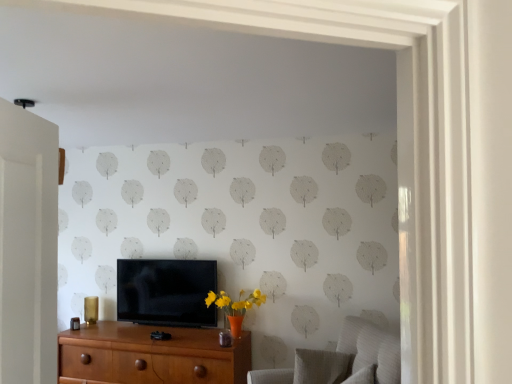
The height and width of the screenshot is (384, 512). I want to click on brown wood chest of drawers at lower center, so click(150, 355).

This screenshot has height=384, width=512. What do you see at coordinates (342, 358) in the screenshot?
I see `textured gray swivel chair at lower right, marked as the second swivel chair in a back-to-front arrangement` at bounding box center [342, 358].

Find the location of a particular element. This screenshot has width=512, height=384. brown wood chest of drawers at lower center is located at coordinates (150, 355).

From a real-world perspective, which object stands above the other?

From a 3D spatial view, textured gray swivel chair at lower right, the first swivel chair viewed from the front, is above.

Is brown wood chest of drawers at lower center next to textured gray swivel chair at lower right, the first swivel chair viewed from the front, and touching it?

They are not placed beside each other.

Between brown wood chest of drawers at lower center and textured gray swivel chair at lower right, marked as the second swivel chair in a back-to-front arrangement, which one has larger width?

textured gray swivel chair at lower right, marked as the second swivel chair in a back-to-front arrangement.

From the image's perspective, is brown wood chest of drawers at lower center over textured gray swivel chair at lower right, marked as the second swivel chair in a back-to-front arrangement?

No, from the image's perspective, brown wood chest of drawers at lower center is not above textured gray swivel chair at lower right, marked as the second swivel chair in a back-to-front arrangement.

Between brown wood chest of drawers at lower center and matte black tv at center, which one has larger size?

brown wood chest of drawers at lower center is bigger.

Does brown wood chest of drawers at lower center come behind matte black tv at center?

No, it is in front of matte black tv at center.

Can you tell me how much brown wood chest of drawers at lower center and matte black tv at center differ in facing direction?

They differ by 2.08 degrees in their facing directions.

In the image, there is a matte black tv at center. Where is `the chest of drawers below it (from the image's perspective)`? the chest of drawers below it (from the image's perspective) is located at coordinates (150, 355).

Is point (356, 356) in front of point (284, 372)?

Yes, it is in front of point (284, 372).

The image size is (512, 384). In the image, there is a textured gray swivel chair at lower right, the 1th swivel chair when ordered from back to front. Find the location of `swivel chair above it (from the image's perspective)`. swivel chair above it (from the image's perspective) is located at coordinates (342, 358).

From a real-world perspective, is textured gray swivel chair at lower right, marked as the second swivel chair in a back-to-front arrangement, over textured gray swivel chair at lower right, the 1th swivel chair when ordered from back to front?

Yes, from a real-world perspective, textured gray swivel chair at lower right, marked as the second swivel chair in a back-to-front arrangement, is above textured gray swivel chair at lower right, the 1th swivel chair when ordered from back to front.

How many degrees apart are the facing directions of textured gray swivel chair at lower right, marked as the second swivel chair in a back-to-front arrangement, and textured gray swivel chair at lower right, the 1th swivel chair when ordered from back to front?

textured gray swivel chair at lower right, marked as the second swivel chair in a back-to-front arrangement, and textured gray swivel chair at lower right, the 1th swivel chair when ordered from back to front, are facing 73.9 degrees away from each other.

Where is `television above the textured gray swivel chair at lower right, the first swivel chair viewed from the front (from the image's perspective)`? This screenshot has height=384, width=512. television above the textured gray swivel chair at lower right, the first swivel chair viewed from the front (from the image's perspective) is located at coordinates (166, 292).

Is matte black tv at center bigger than textured gray swivel chair at lower right, the first swivel chair viewed from the front?

No, matte black tv at center is not bigger than textured gray swivel chair at lower right, the first swivel chair viewed from the front.

Is matte black tv at center positioned far away from textured gray swivel chair at lower right, the first swivel chair viewed from the front?

Yes, matte black tv at center is far from textured gray swivel chair at lower right, the first swivel chair viewed from the front.

Measure the distance from matte black tv at center to textured gray swivel chair at lower right, marked as the second swivel chair in a back-to-front arrangement.

4.19 feet.

Considering the sizes of objects brown wood chest of drawers at lower center and textured gray swivel chair at lower right, the 1th swivel chair when ordered from back to front, in the image provided, who is smaller, brown wood chest of drawers at lower center or textured gray swivel chair at lower right, the 1th swivel chair when ordered from back to front,?

textured gray swivel chair at lower right, the 1th swivel chair when ordered from back to front, is smaller.

Is brown wood chest of drawers at lower center turned away from textured gray swivel chair at lower right, the 1th swivel chair when ordered from back to front?

No, brown wood chest of drawers at lower center is not facing the opposite direction of textured gray swivel chair at lower right, the 1th swivel chair when ordered from back to front.

Which object is thinner, brown wood chest of drawers at lower center or textured gray swivel chair at lower right, which ranks as the 2th swivel chair in front-to-back order?

With smaller width is textured gray swivel chair at lower right, which ranks as the 2th swivel chair in front-to-back order.

Is textured gray swivel chair at lower right, the first swivel chair viewed from the front, oriented towards matte black tv at center?

No, textured gray swivel chair at lower right, the first swivel chair viewed from the front, is not oriented towards matte black tv at center.

From a real-world perspective, between textured gray swivel chair at lower right, the first swivel chair viewed from the front, and matte black tv at center, who is vertically higher?

matte black tv at center, from a real-world perspective.

Can you confirm if textured gray swivel chair at lower right, marked as the second swivel chair in a back-to-front arrangement, is positioned to the left of matte black tv at center?

No.

What are the coordinates of `swivel chair that is the 1st object directly below the matte black tv at center (from a real-world perspective)` in the screenshot? It's located at click(342, 358).

From the image's perspective, is textured gray swivel chair at lower right, marked as the second swivel chair in a back-to-front arrangement, positioned above or below brown wood chest of drawers at lower center?

Based on their image positions, textured gray swivel chair at lower right, marked as the second swivel chair in a back-to-front arrangement, is located above brown wood chest of drawers at lower center.

Which object is more forward, textured gray swivel chair at lower right, marked as the second swivel chair in a back-to-front arrangement, or brown wood chest of drawers at lower center?

textured gray swivel chair at lower right, marked as the second swivel chair in a back-to-front arrangement, is in front.

You are a GUI agent. You are given a task and a screenshot of the screen. Output one action in this format:
    pyautogui.click(x=<x>, y=<y>)
    Task: Click on the swivel chair that is the 2nd object located in front of the brown wood chest of drawers at lower center
    The image size is (512, 384).
    Given the screenshot: What is the action you would take?
    pyautogui.click(x=342, y=358)

In the image, there is a matte black tv at center. Find the location of `the chest of drawers below it (from the image's perspective)`. the chest of drawers below it (from the image's perspective) is located at coordinates (150, 355).

Estimate the real-world distances between objects in this image. Which object is closer to matte black tv at center, textured gray swivel chair at lower right, the first swivel chair viewed from the front, or brown wood chest of drawers at lower center?

Among the two, brown wood chest of drawers at lower center is located nearer to matte black tv at center.

Estimate the real-world distances between objects in this image. Which object is closer to brown wood chest of drawers at lower center, textured gray swivel chair at lower right, which ranks as the 2th swivel chair in front-to-back order, or textured gray swivel chair at lower right, marked as the second swivel chair in a back-to-front arrangement?

Among the two, textured gray swivel chair at lower right, which ranks as the 2th swivel chair in front-to-back order, is located nearer to brown wood chest of drawers at lower center.

Considering their positions, is brown wood chest of drawers at lower center positioned further to matte black tv at center than textured gray swivel chair at lower right, which ranks as the 2th swivel chair in front-to-back order?

textured gray swivel chair at lower right, which ranks as the 2th swivel chair in front-to-back order, lies further to matte black tv at center than the other object.

Looking at this image, estimate the real-world distances between objects in this image. Which object is further from textured gray swivel chair at lower right, marked as the second swivel chair in a back-to-front arrangement, matte black tv at center or textured gray swivel chair at lower right, which ranks as the 2th swivel chair in front-to-back order?

The object further to textured gray swivel chair at lower right, marked as the second swivel chair in a back-to-front arrangement, is matte black tv at center.

Looking at the image, which one is located closer to textured gray swivel chair at lower right, which ranks as the 2th swivel chair in front-to-back order, matte black tv at center or brown wood chest of drawers at lower center?

brown wood chest of drawers at lower center lies closer to textured gray swivel chair at lower right, which ranks as the 2th swivel chair in front-to-back order, than the other object.

When comparing their distances from matte black tv at center, does brown wood chest of drawers at lower center or textured gray swivel chair at lower right, the first swivel chair viewed from the front, seem further?

The object further to matte black tv at center is textured gray swivel chair at lower right, the first swivel chair viewed from the front.

Which object lies nearer to the anchor point brown wood chest of drawers at lower center, textured gray swivel chair at lower right, marked as the second swivel chair in a back-to-front arrangement, or matte black tv at center?

matte black tv at center is positioned closer to the anchor brown wood chest of drawers at lower center.

Looking at the image, which one is located closer to brown wood chest of drawers at lower center, matte black tv at center or textured gray swivel chair at lower right, the first swivel chair viewed from the front?

matte black tv at center lies closer to brown wood chest of drawers at lower center than the other object.

Locate an element on the screen. The height and width of the screenshot is (384, 512). swivel chair between matte black tv at center and textured gray swivel chair at lower right, marked as the second swivel chair in a back-to-front arrangement is located at coordinates (308, 369).

Where is `swivel chair between brown wood chest of drawers at lower center and textured gray swivel chair at lower right, the first swivel chair viewed from the front, from left to right`? Image resolution: width=512 pixels, height=384 pixels. swivel chair between brown wood chest of drawers at lower center and textured gray swivel chair at lower right, the first swivel chair viewed from the front, from left to right is located at coordinates (308, 369).

You are a GUI agent. You are given a task and a screenshot of the screen. Output one action in this format:
    pyautogui.click(x=<x>, y=<y>)
    Task: Click on the television between brown wood chest of drawers at lower center and textured gray swivel chair at lower right, marked as the second swivel chair in a back-to-front arrangement, in the horizontal direction
    This screenshot has height=384, width=512.
    Given the screenshot: What is the action you would take?
    pyautogui.click(x=166, y=292)

Locate an element on the screen. The width and height of the screenshot is (512, 384). television between brown wood chest of drawers at lower center and textured gray swivel chair at lower right, which ranks as the 2th swivel chair in front-to-back order, from left to right is located at coordinates pos(166,292).